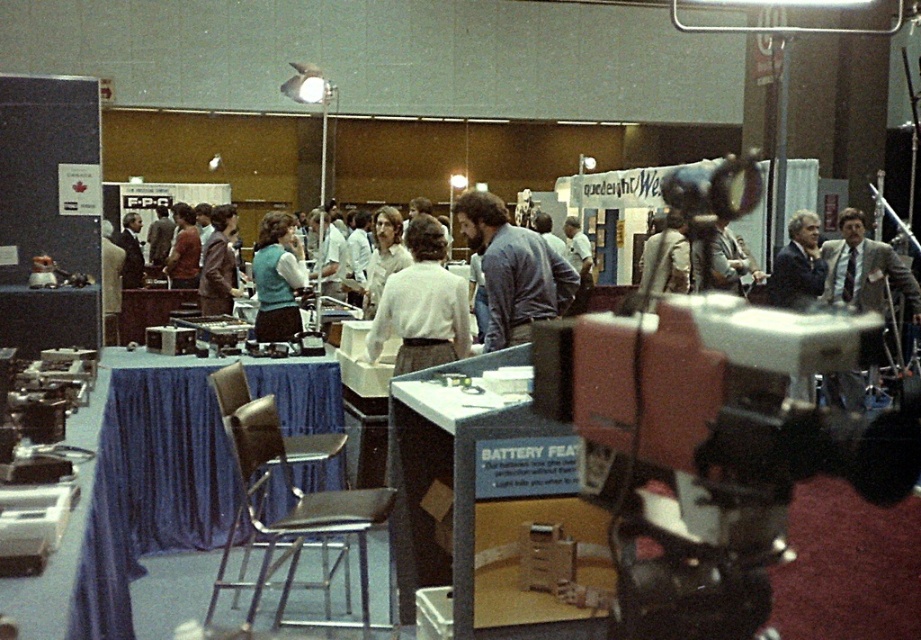
You are a photographer at the event and need to adjust your focus. You have two points to focus on in the image. The first is at point (538, 244) and the second is at point (270, 246). Which point should you focus on first if you want to start with the one closer to the camera?

You should focus on point (538, 244) first because it is closer to the camera than point (270, 246) according to the description.

You are organizing a photo shoot and need to ensure that the blue cotton shirt at center and the matte blue vest at center are both visible in the frame. Given their sizes, which item should you prioritize positioning closer to the camera to ensure it doesn t get obscured?

The blue cotton shirt at center occupies less space than the matte blue vest at center, so you should prioritize positioning the blue cotton shirt at center closer to the camera to ensure it doesn t get obscured by the larger matte blue vest at center.